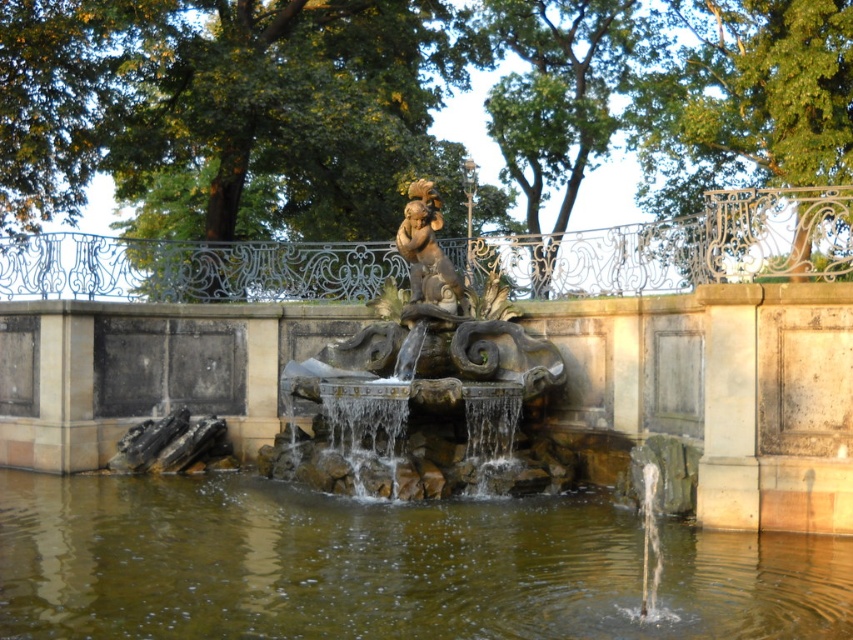
Is stone fountain at center taller than gold polished statue at center?

Yes, stone fountain at center is taller than gold polished statue at center.

Between stone fountain at center and gold polished statue at center, which one is positioned lower?

stone fountain at center is lower down.

You are a GUI agent. You are given a task and a screenshot of the screen. Output one action in this format:
    pyautogui.click(x=<x>, y=<y>)
    Task: Click on the stone fountain at center
    This screenshot has height=640, width=853.
    Given the screenshot: What is the action you would take?
    pyautogui.click(x=424, y=388)

From the picture: How distant is brown stone water at center from gold polished statue at center?

brown stone water at center is 35.15 feet away from gold polished statue at center.

In the scene shown: Is brown stone water at center in front of gold polished statue at center?

Yes, it is in front of gold polished statue at center.

Which is behind, point (613, 600) or point (450, 285)?

Positioned behind is point (450, 285).

Where is `brown stone water at center`? This screenshot has height=640, width=853. brown stone water at center is located at coordinates (386, 566).

Is brown stone water at center above stone fountain at center?

Incorrect, brown stone water at center is not positioned above stone fountain at center.

Can you confirm if brown stone water at center is wider than stone fountain at center?

Yes, brown stone water at center is wider than stone fountain at center.

Is point (245, 496) closer to camera compared to point (524, 465)?

Yes.

Where is `brown stone water at center`? brown stone water at center is located at coordinates (386, 566).